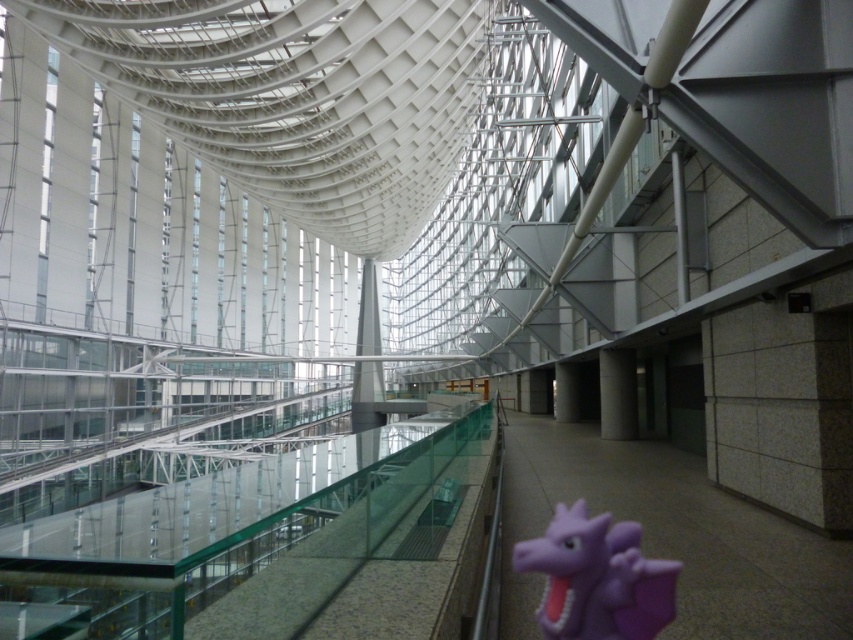
Can you confirm if purple rubber dragon at lower right is shorter than white smooth pillar at center?

Yes.

The image size is (853, 640). In order to click on purple rubber dragon at lower right in this screenshot , I will do `click(596, 579)`.

Is point (572, 602) positioned behind point (614, 378)?

That is False.

At what (x,y) coordinates should I click in order to perform the action: click on purple rubber dragon at lower right. Please return your answer as a coordinate pair (x, y). Looking at the image, I should click on (596, 579).

Consider the image. Measure the distance between purple rubber dragon at lower right and white concrete pillar at center.

They are 21.79 meters apart.

Who is lower down, purple rubber dragon at lower right or white concrete pillar at center?

Positioned lower is white concrete pillar at center.

Is point (633, 600) positioned behind point (567, 420)?

That is False.

The image size is (853, 640). I want to click on purple rubber dragon at lower right, so click(596, 579).

Who is lower down, white glossy pillar at center or white smooth pillar at center?

Result: Positioned lower is white smooth pillar at center.

Can you confirm if white glossy pillar at center is taller than white smooth pillar at center?

Indeed, white glossy pillar at center has a greater height compared to white smooth pillar at center.

Is point (363, 429) positioned after point (601, 369)?

That is True.

The width and height of the screenshot is (853, 640). I want to click on white glossy pillar at center, so click(x=367, y=371).